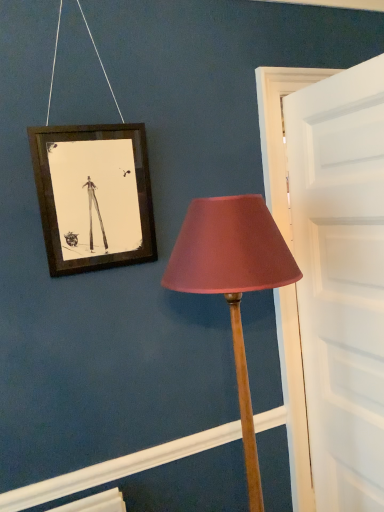
Question: Considering the relative sizes of matte pink fabric lampshade at center-right and white matte door at right in the image provided, is matte pink fabric lampshade at center-right thinner than white matte door at right?

Choices:
 (A) yes
 (B) no

Answer: (B)

Question: Is matte pink fabric lampshade at center-right further to camera compared to white matte door at right?

Choices:
 (A) yes
 (B) no

Answer: (B)

Question: Is matte pink fabric lampshade at center-right next to white matte door at right and touching it?

Choices:
 (A) no
 (B) yes

Answer: (A)

Question: Can we say matte pink fabric lampshade at center-right lies outside white matte door at right?

Choices:
 (A) no
 (B) yes

Answer: (B)

Question: Is matte pink fabric lampshade at center-right positioned with its back to white matte door at right?

Choices:
 (A) yes
 (B) no

Answer: (B)

Question: Is matte pink fabric lampshade at center-right far away from white matte door at right?

Choices:
 (A) no
 (B) yes

Answer: (A)

Question: Is the surface of white matte door at right in direct contact with matte pink fabric lampshade at center-right?

Choices:
 (A) yes
 (B) no

Answer: (B)

Question: Considering the relative sizes of white matte door at right and matte pink fabric lampshade at center-right in the image provided, is white matte door at right smaller than matte pink fabric lampshade at center-right?

Choices:
 (A) no
 (B) yes

Answer: (B)

Question: Is white matte door at right bigger than matte pink fabric lampshade at center-right?

Choices:
 (A) yes
 (B) no

Answer: (B)

Question: Is white matte door at right closer to the viewer compared to matte pink fabric lampshade at center-right?

Choices:
 (A) no
 (B) yes

Answer: (A)

Question: Does white matte door at right lie behind matte pink fabric lampshade at center-right?

Choices:
 (A) yes
 (B) no

Answer: (A)

Question: Is white matte door at right not within matte pink fabric lampshade at center-right?

Choices:
 (A) yes
 (B) no

Answer: (A)

Question: Looking at their shapes, would you say matte pink fabric lampshade at center-right is wider or thinner than white matte door at right?

Choices:
 (A) wide
 (B) thin

Answer: (A)